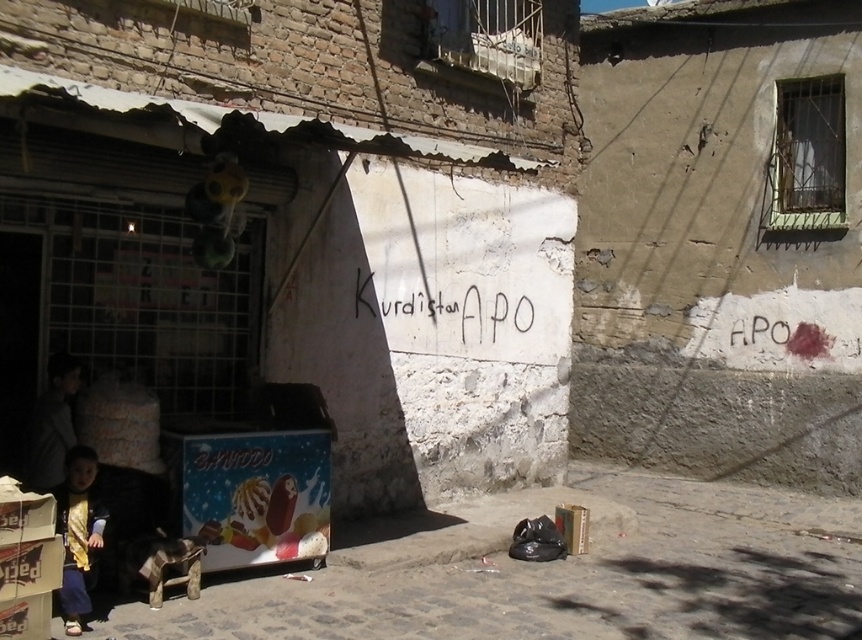
Question: Can you confirm if black painted graffiti at center is thinner than dark gray jacket at lower left?

Choices:
 (A) no
 (B) yes

Answer: (A)

Question: Which object is the farthest from the dark gray jacket at lower left?

Choices:
 (A) cardboard ice cream stand at lower left
 (B) black painted graffiti at center

Answer: (A)

Question: Which is farther from the black painted graffiti at center?

Choices:
 (A) dark gray jacket at lower left
 (B) cardboard ice cream stand at lower left

Answer: (A)

Question: Which object appears farthest from the camera in this image?

Choices:
 (A) cardboard ice cream stand at lower left
 (B) dark gray jacket at lower left
 (C) black painted graffiti at center

Answer: (C)

Question: Can you confirm if cardboard ice cream stand at lower left is positioned to the right of dark gray jacket at lower left?

Choices:
 (A) yes
 (B) no

Answer: (A)

Question: Is cardboard ice cream stand at lower left to the left of dark gray jacket at lower left from the viewer's perspective?

Choices:
 (A) yes
 (B) no

Answer: (B)